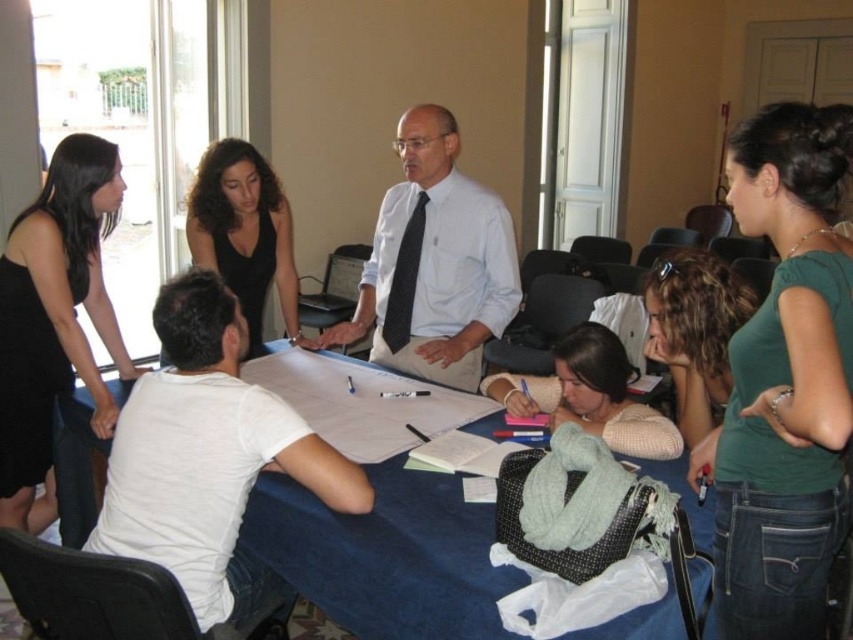
Is point (799, 371) more distant than point (428, 260)?

No, (799, 371) is closer to viewer.

Is green matte shirt at upper right positioned in front of white shirt at center?

Yes, green matte shirt at upper right is closer to the viewer.

Which is in front, point (815, 310) or point (422, 188)?

Point (815, 310)

This screenshot has width=853, height=640. Find the location of `green matte shirt at upper right`. green matte shirt at upper right is located at coordinates (784, 381).

Between point (482, 582) and point (285, 257), which one is positioned behind?

The point (285, 257) is more distant.

Does blue fabric table at center have a lesser width compared to black dress at center?

In fact, blue fabric table at center might be wider than black dress at center.

Is point (437, 596) positioned after point (218, 141)?

No, (437, 596) is closer to viewer.

Locate an element on the screen. The width and height of the screenshot is (853, 640). blue fabric table at center is located at coordinates (386, 554).

This screenshot has width=853, height=640. Describe the element at coordinates (784, 381) in the screenshot. I see `green matte shirt at upper right` at that location.

Which is behind, point (811, 337) or point (541, 412)?

The point (541, 412) is more distant.

Identify the location of green matte shirt at upper right. coord(784,381).